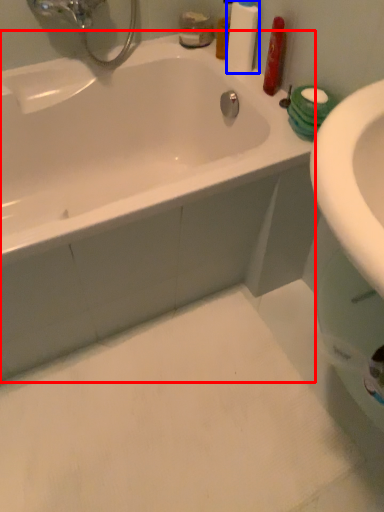
Question: Which object is further to the camera taking this photo, bathtub (highlighted by a red box) or cleaning product (highlighted by a blue box)?

Choices:
 (A) bathtub
 (B) cleaning product

Answer: (B)